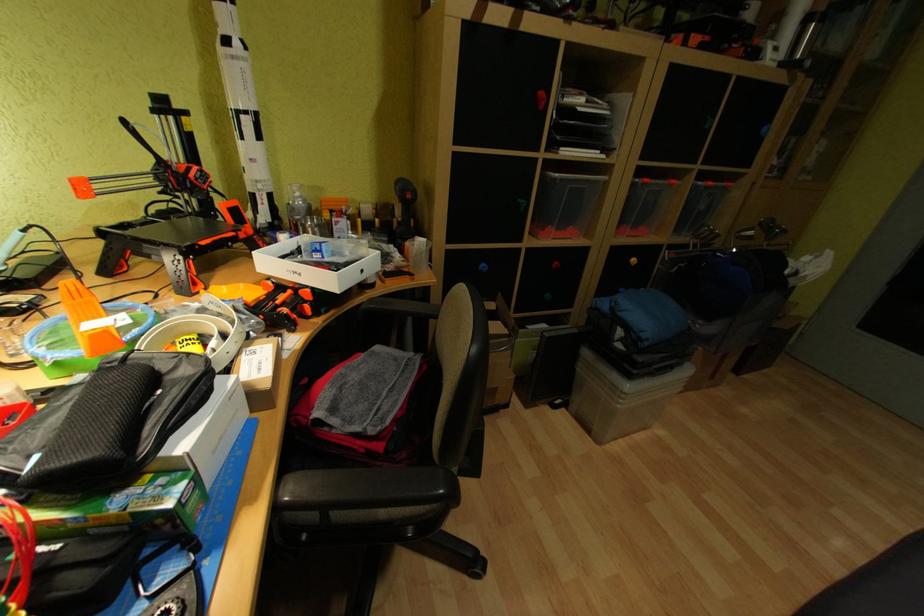
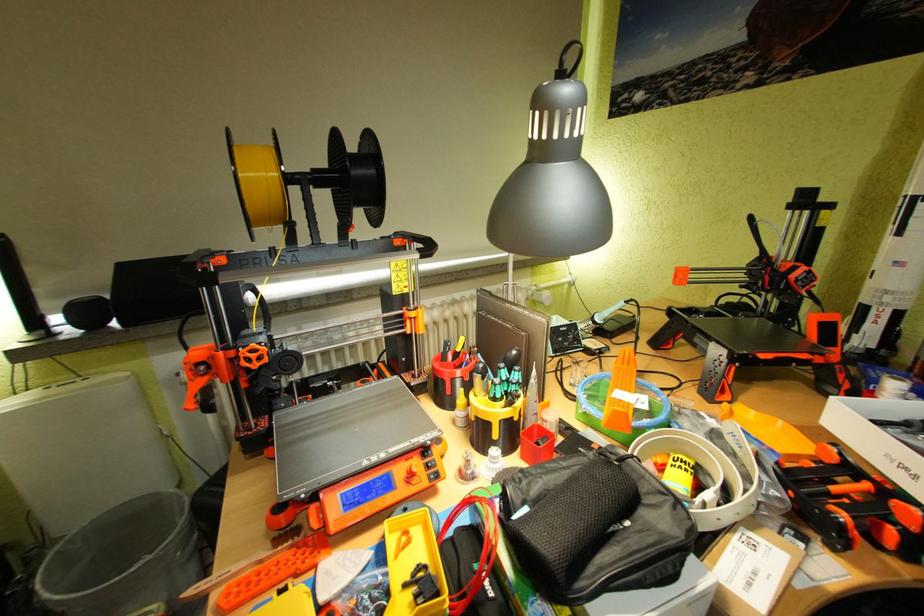
Question: How did the camera likely rotate?

Choices:
 (A) Left
 (B) Right
 (C) Up
 (D) Down

Answer: (A)